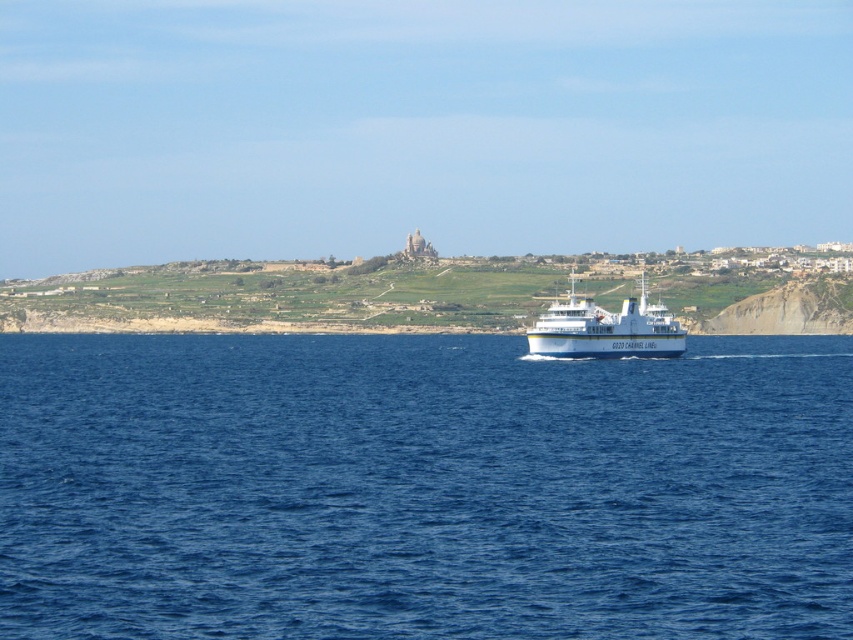
In the scene shown: Does blue water at center have a greater height compared to white glossy cruise ship at center?

No, blue water at center is not taller than white glossy cruise ship at center.

The height and width of the screenshot is (640, 853). I want to click on blue water at center, so click(422, 488).

This screenshot has width=853, height=640. I want to click on blue water at center, so click(422, 488).